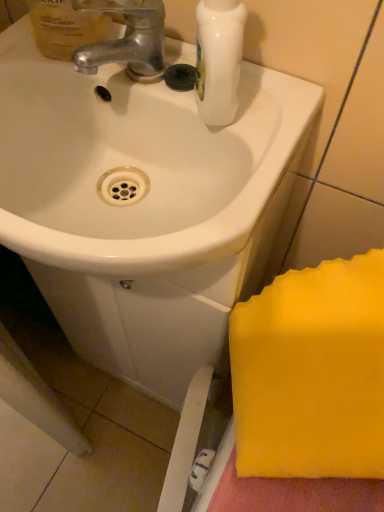
Question: From the image's perspective, is white glossy sink at center on translucent plastic mouthwash at upper left?

Choices:
 (A) yes
 (B) no

Answer: (B)

Question: Considering the relative sizes of white glossy sink at center and translucent plastic mouthwash at upper left in the image provided, is white glossy sink at center wider than translucent plastic mouthwash at upper left?

Choices:
 (A) no
 (B) yes

Answer: (B)

Question: Considering the relative positions of white glossy sink at center and translucent plastic mouthwash at upper left in the image provided, is white glossy sink at center to the right of translucent plastic mouthwash at upper left from the viewer's perspective?

Choices:
 (A) no
 (B) yes

Answer: (B)

Question: Would you say white glossy sink at center contains translucent plastic mouthwash at upper left?

Choices:
 (A) yes
 (B) no

Answer: (B)

Question: Considering the relative sizes of white glossy sink at center and translucent plastic mouthwash at upper left in the image provided, is white glossy sink at center smaller than translucent plastic mouthwash at upper left?

Choices:
 (A) no
 (B) yes

Answer: (A)

Question: In terms of height, does silver metallic faucet at upper left look taller or shorter compared to translucent plastic mouthwash at upper left?

Choices:
 (A) short
 (B) tall

Answer: (A)

Question: Is silver metallic faucet at upper left inside or outside of translucent plastic mouthwash at upper left?

Choices:
 (A) outside
 (B) inside

Answer: (A)

Question: Is silver metallic faucet at upper left wider or thinner than translucent plastic mouthwash at upper left?

Choices:
 (A) thin
 (B) wide

Answer: (B)

Question: Based on their sizes in the image, would you say silver metallic faucet at upper left is bigger or smaller than translucent plastic mouthwash at upper left?

Choices:
 (A) small
 (B) big

Answer: (A)

Question: Is white glossy sink at center taller or shorter than translucent plastic mouthwash at upper left?

Choices:
 (A) tall
 (B) short

Answer: (B)

Question: Do you think white glossy sink at center is within translucent plastic mouthwash at upper left, or outside of it?

Choices:
 (A) outside
 (B) inside

Answer: (A)

Question: Is white glossy sink at center wider or thinner than translucent plastic mouthwash at upper left?

Choices:
 (A) wide
 (B) thin

Answer: (A)

Question: In terms of size, does white glossy sink at center appear bigger or smaller than translucent plastic mouthwash at upper left?

Choices:
 (A) big
 (B) small

Answer: (A)

Question: Considering the positions of silver metallic faucet at upper left and white glossy sink at center in the image, is silver metallic faucet at upper left taller or shorter than white glossy sink at center?

Choices:
 (A) short
 (B) tall

Answer: (A)

Question: In the image, is silver metallic faucet at upper left on the left side or the right side of white glossy sink at center?

Choices:
 (A) left
 (B) right

Answer: (B)